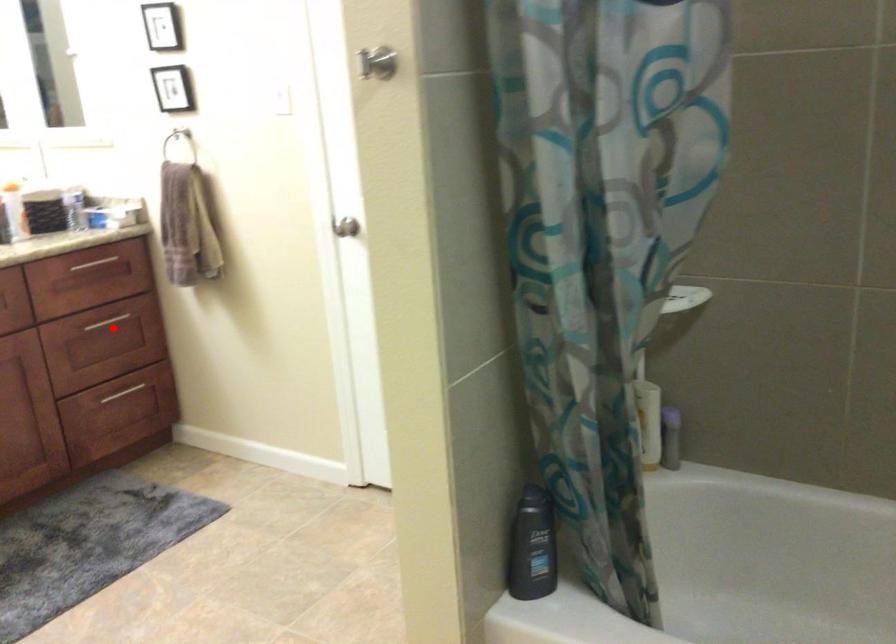
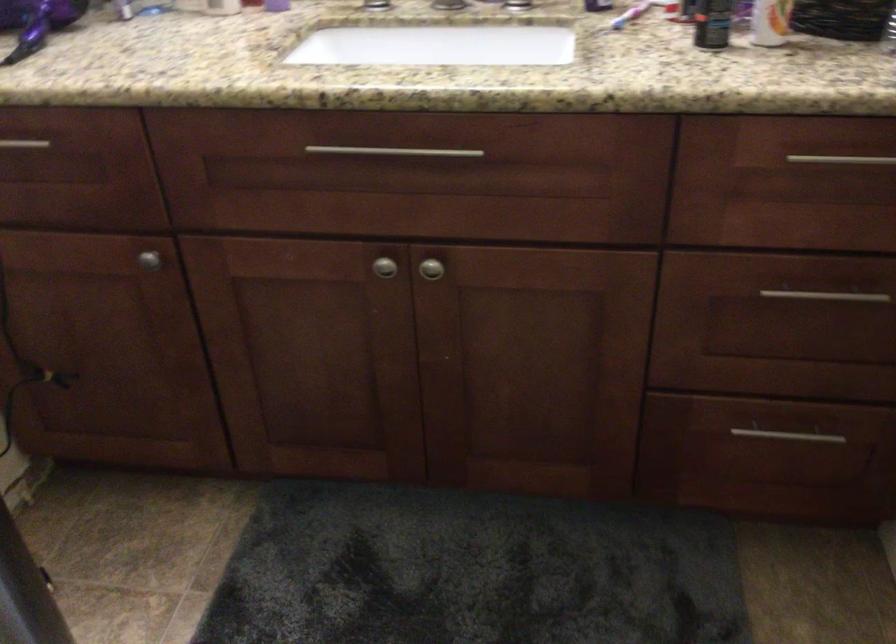
Question: I am providing you with two images of the same scene from different viewpoints. Given a red point in image1, look at the same physical point in image2. Is it:

Choices:
 (A) Closer to the viewpoint
 (B) Farther from the viewpoint

Answer: (A)